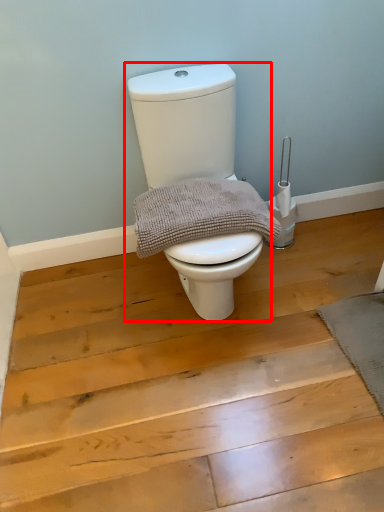
Question: From the image's perspective, considering the relative positions of toilet (annotated by the red box) and material in the image provided, where is toilet (annotated by the red box) located with respect to the staircase?

Choices:
 (A) above
 (B) below

Answer: (A)